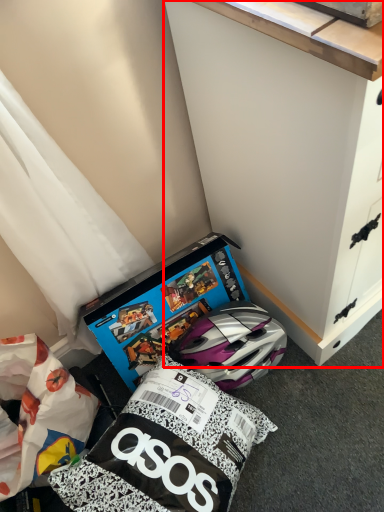
Question: In this image, where is cabinetry (annotated by the red box) located relative to box?

Choices:
 (A) right
 (B) left

Answer: (A)